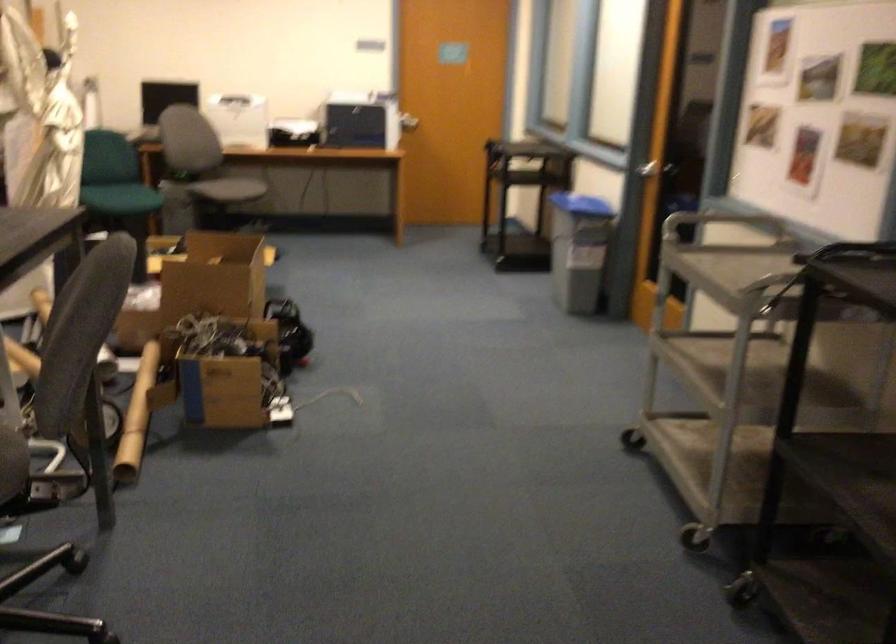
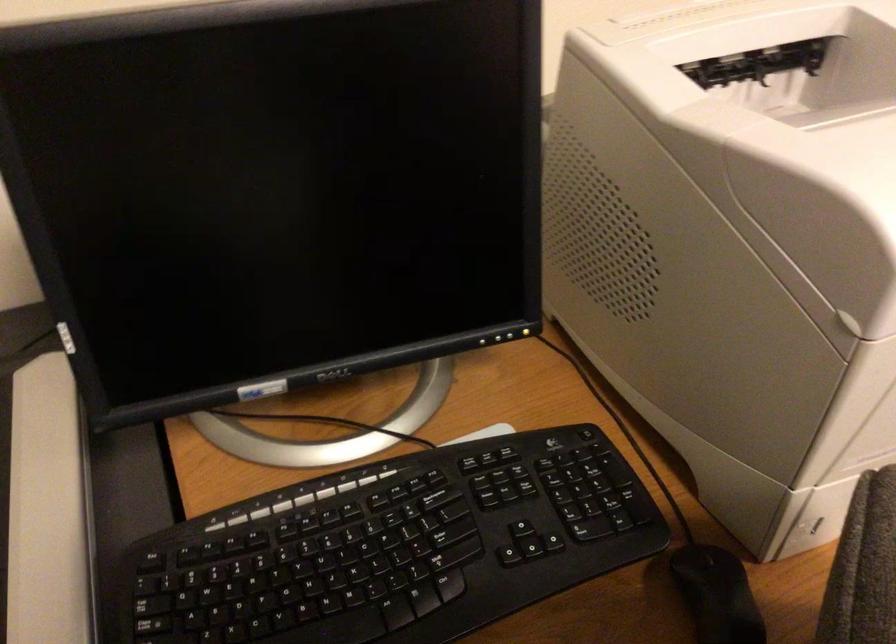
Where in the second image is the point corresponding to point 228,80 from the first image?

(616, 21)